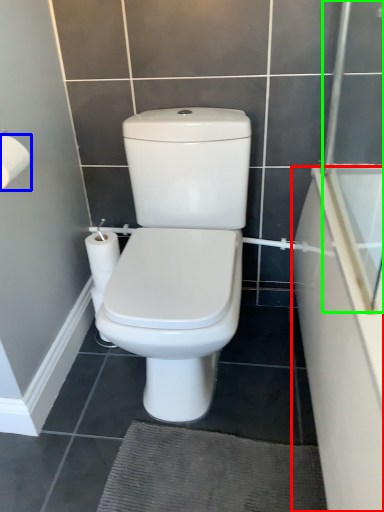
Question: Which is farther away from bath (highlighted by a red box)? toilet paper (highlighted by a blue box) or screen door (highlighted by a green box)?

Choices:
 (A) toilet paper
 (B) screen door

Answer: (A)